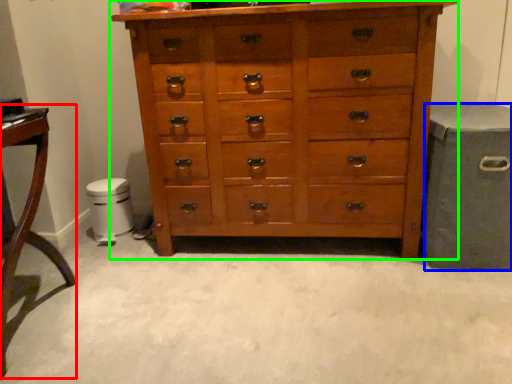
Question: Based on their relative distances, which object is nearer to table (highlighted by a red box)? Choose from gray (highlighted by a blue box) and chest of drawers (highlighted by a green box).

Choices:
 (A) gray
 (B) chest of drawers

Answer: (B)